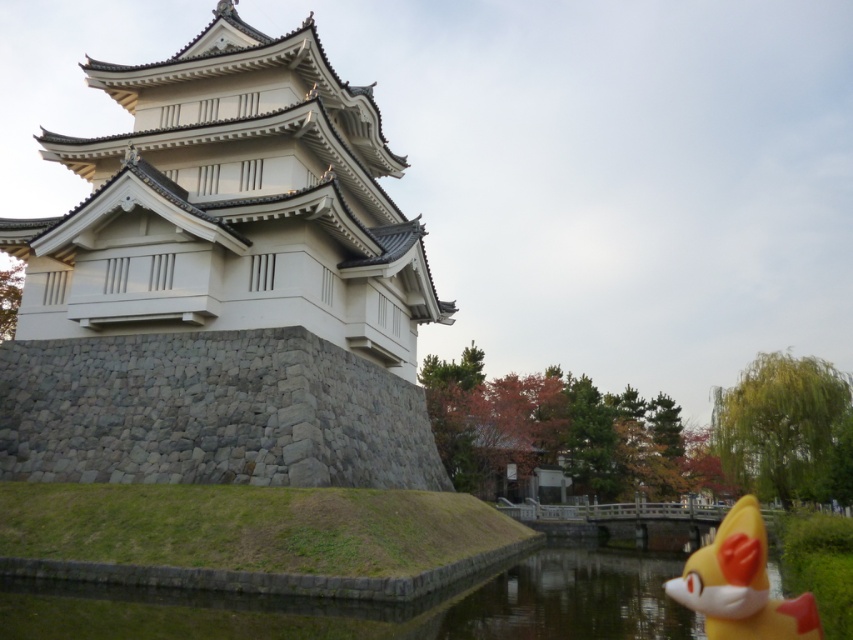
Does white stone tower at center have a greater width compared to yellow matte fox at lower right?

Yes, white stone tower at center is wider than yellow matte fox at lower right.

Does white stone tower at center have a lesser width compared to yellow matte fox at lower right?

In fact, white stone tower at center might be wider than yellow matte fox at lower right.

The width and height of the screenshot is (853, 640). What do you see at coordinates (223, 284) in the screenshot?
I see `white stone tower at center` at bounding box center [223, 284].

Locate an element on the screen. The image size is (853, 640). white stone tower at center is located at coordinates (223, 284).

Does clear water at lower center have a lesser width compared to yellow matte fox at lower right?

In fact, clear water at lower center might be wider than yellow matte fox at lower right.

Can you confirm if clear water at lower center is positioned to the right of yellow matte fox at lower right?

In fact, clear water at lower center is to the left of yellow matte fox at lower right.

Locate an element on the screen. Image resolution: width=853 pixels, height=640 pixels. clear water at lower center is located at coordinates (380, 608).

Is white stone tower at center closer to camera compared to clear water at lower center?

No, it is not.

Image resolution: width=853 pixels, height=640 pixels. I want to click on white stone tower at center, so click(223, 284).